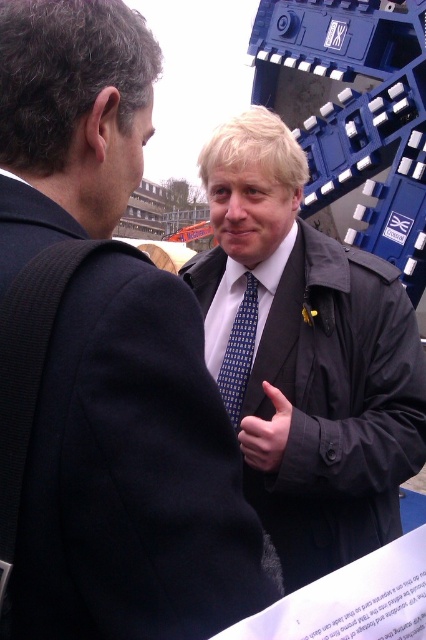
You are a GUI agent. You are given a task and a screenshot of the screen. Output one action in this format:
    pyautogui.click(x=<x>, y=<y>)
    Task: Click on the matte black suit at center
    The width and height of the screenshot is (426, 640).
    Given the screenshot: What is the action you would take?
    pyautogui.click(x=106, y=360)

Can you confirm if matte black suit at center is wider than blue dotted tie at center?

Yes, matte black suit at center is wider than blue dotted tie at center.

Is point (26, 435) farther from viewer compared to point (249, 296)?

No, it is not.

I want to click on matte black suit at center, so click(106, 360).

Measure the distance between matte black suit at center and camera.

matte black suit at center and camera are 68.76 feet apart.

Which of these two, matte black suit at center or matte black jacket at center, stands taller?

matte black jacket at center is taller.

Does point (48, 102) lie behind point (376, 422)?

That is False.

Where is `matte black suit at center`? The width and height of the screenshot is (426, 640). matte black suit at center is located at coordinates (106, 360).

Does point (293, 276) come behind point (241, 321)?

No, it is not.

Which is above, matte black jacket at center or blue dotted tie at center?

matte black jacket at center is above.

Between point (333, 540) and point (245, 321), which one is positioned in front?

Point (333, 540)

The image size is (426, 640). I want to click on matte black jacket at center, so click(307, 353).